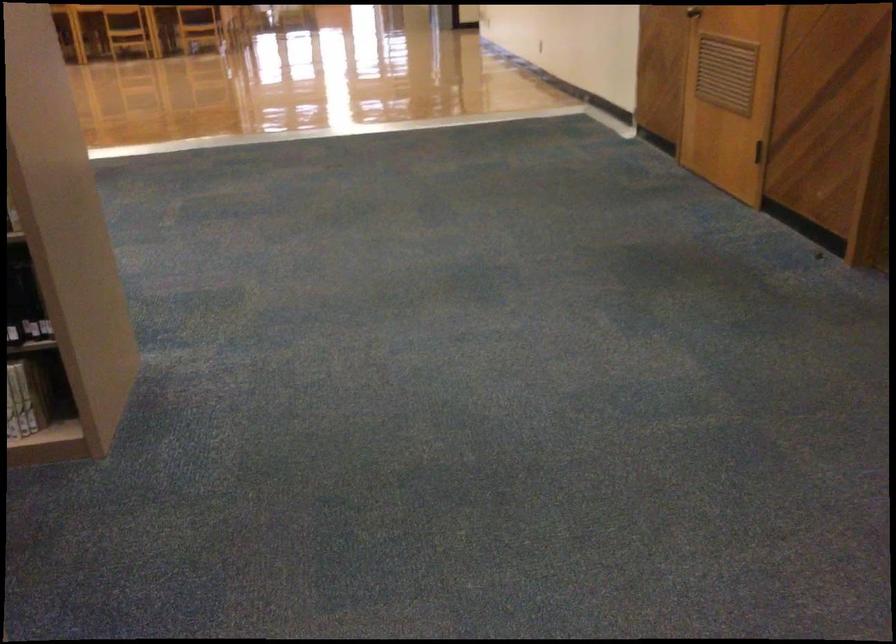
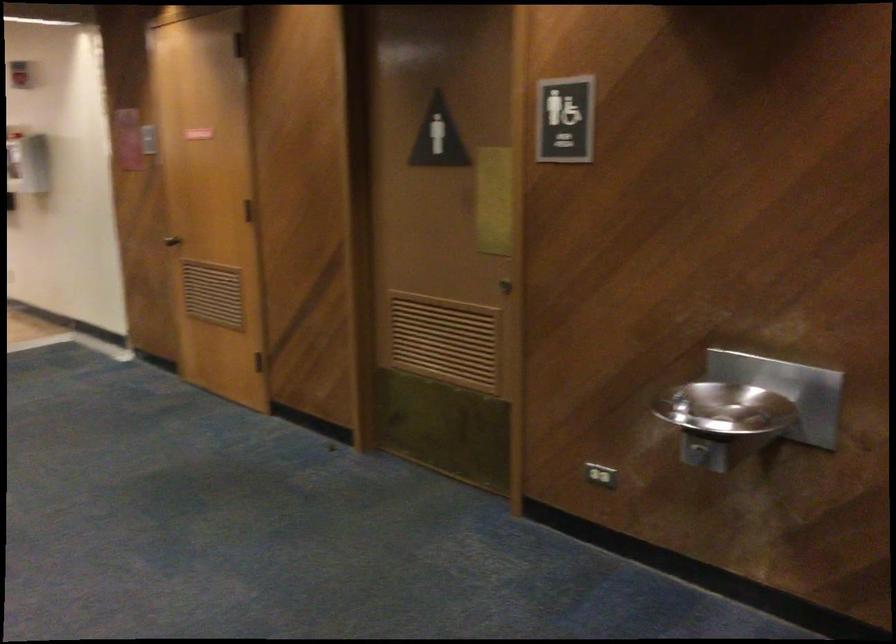
Question: How did the camera likely rotate?

Choices:
 (A) Left
 (B) Right
 (C) Up
 (D) Down

Answer: (B)